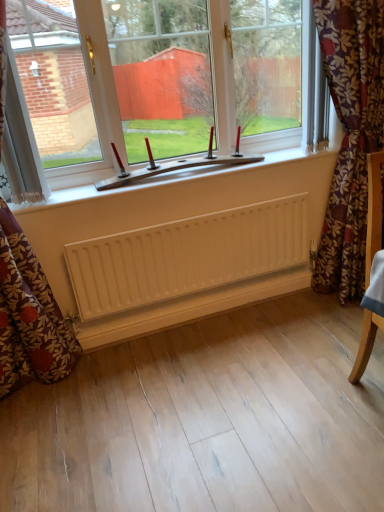
Where is `free spot below floral fabric curtain at left, positioned as the 2th curtain in left-to-right order (from a real-world perspective)`? The image size is (384, 512). free spot below floral fabric curtain at left, positioned as the 2th curtain in left-to-right order (from a real-world perspective) is located at coordinates click(x=70, y=378).